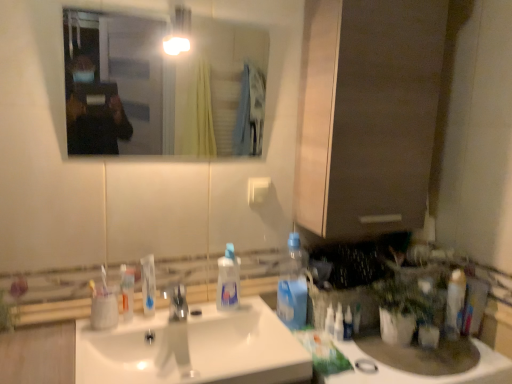
The image size is (512, 384). Find the location of `vacant region to the left of polished chrome faucet at center`. vacant region to the left of polished chrome faucet at center is located at coordinates (134, 331).